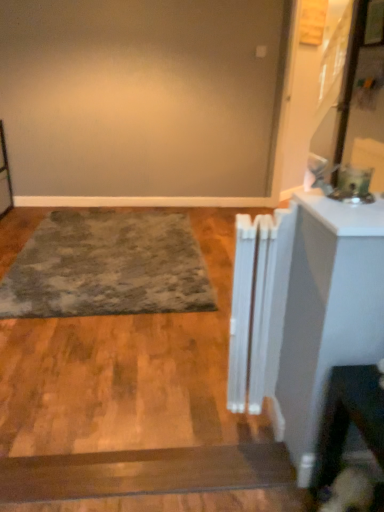
The height and width of the screenshot is (512, 384). What do you see at coordinates (107, 266) in the screenshot?
I see `textured gray rug at center` at bounding box center [107, 266].

Find the location of a particular element. The width and height of the screenshot is (384, 512). white plastic radiator at center is located at coordinates (258, 306).

What do you see at coordinates (349, 492) in the screenshot? I see `fuzzy brown dog at lower right` at bounding box center [349, 492].

The height and width of the screenshot is (512, 384). In order to click on white glossy counter top at right in this screenshot , I will do `click(344, 214)`.

Identify the location of textured gray rug at center. This screenshot has width=384, height=512. (107, 266).

Does textured gray rug at center have a greater height compared to white glossy counter top at right?

Correct, textured gray rug at center is much taller as white glossy counter top at right.

From the image's perspective, would you say textured gray rug at center is positioned over white glossy counter top at right?

Actually, textured gray rug at center appears below white glossy counter top at right in the image.

Is textured gray rug at center beside white glossy counter top at right?

textured gray rug at center and white glossy counter top at right are not in contact.

The image size is (384, 512). Find the location of `mat below the white glossy counter top at right (from the image's perspective)`. mat below the white glossy counter top at right (from the image's perspective) is located at coordinates (107, 266).

Between white plastic radiator at center and textured gray rug at center, which one has less height?

textured gray rug at center.

Is white plastic radiator at center turned away from textured gray rug at center?

No, textured gray rug at center is not at the back of white plastic radiator at center.

From the image's perspective, is white plastic radiator at center beneath textured gray rug at center?

Correct, white plastic radiator at center appears lower than textured gray rug at center in the image.

Which of these two, white plastic radiator at center or textured gray rug at center, is smaller?

With smaller size is white plastic radiator at center.

Can you see white glossy counter top at right touching textured gray rug at center?

No, white glossy counter top at right is not next to textured gray rug at center.

Which is farther from the camera, (x=302, y=206) or (x=92, y=308)?

Positioned behind is point (x=92, y=308).

Is white glossy counter top at right spatially inside textured gray rug at center, or outside of it?

white glossy counter top at right lies outside textured gray rug at center.

Is the position of fuzzy brown dog at lower right less distant than that of textured gray rug at center?

Yes, fuzzy brown dog at lower right is in front of textured gray rug at center.

Considering the positions of objects fuzzy brown dog at lower right and textured gray rug at center in the image provided, who is more to the right, fuzzy brown dog at lower right or textured gray rug at center?

Positioned to the right is fuzzy brown dog at lower right.

Consider the image. Is fuzzy brown dog at lower right beside textured gray rug at center?

They are not placed beside each other.

From the image's perspective, is fuzzy brown dog at lower right located above or below textured gray rug at center?

Based on their image positions, fuzzy brown dog at lower right is located beneath textured gray rug at center.

The width and height of the screenshot is (384, 512). In order to click on radiator that appears behind the white glossy counter top at right in this screenshot , I will do `click(258, 306)`.

From a real-world perspective, is white glossy counter top at right positioned under white plastic radiator at center based on gravity?

No, from a real-world perspective, white glossy counter top at right is not beneath white plastic radiator at center.

Does white glossy counter top at right have a smaller size compared to white plastic radiator at center?

Yes, white glossy counter top at right is smaller than white plastic radiator at center.

In terms of height, does white plastic radiator at center look taller or shorter compared to white glossy counter top at right?

Clearly, white plastic radiator at center is taller compared to white glossy counter top at right.

Which is farther from the camera, (241, 369) or (345, 211)?

Point (241, 369)

Considering the relative positions of white plastic radiator at center and white glossy counter top at right in the image provided, is white plastic radiator at center to the left of white glossy counter top at right from the viewer's perspective?

Yes.

Which object is wider, white plastic radiator at center or white glossy counter top at right?

white glossy counter top at right.

Is textured gray rug at center inside or outside of fuzzy brown dog at lower right?

The correct answer is: outside.

From the image's perspective, is textured gray rug at center beneath fuzzy brown dog at lower right?

Incorrect, from the image's perspective, textured gray rug at center is higher than fuzzy brown dog at lower right.

Who is smaller, textured gray rug at center or fuzzy brown dog at lower right?

With smaller size is fuzzy brown dog at lower right.

This screenshot has height=512, width=384. In order to click on counter top positioned vertically above the textured gray rug at center (from a real-world perspective) in this screenshot , I will do `click(344, 214)`.

Image resolution: width=384 pixels, height=512 pixels. What are the coordinates of `radiator that appears in front of the textured gray rug at center` in the screenshot? It's located at (258, 306).

Which object lies nearer to the anchor point white glossy counter top at right, textured gray rug at center or fuzzy brown dog at lower right?

fuzzy brown dog at lower right.

Estimate the real-world distances between objects in this image. Which object is closer to fuzzy brown dog at lower right, white plastic radiator at center or textured gray rug at center?

white plastic radiator at center is positioned closer to the anchor fuzzy brown dog at lower right.

Looking at this image, from the image, which object appears to be nearer to white glossy counter top at right, fuzzy brown dog at lower right or white plastic radiator at center?

white plastic radiator at center.

Looking at the image, which one is located further to textured gray rug at center, fuzzy brown dog at lower right or white plastic radiator at center?

fuzzy brown dog at lower right is positioned further to the anchor textured gray rug at center.

Looking at this image, considering their positions, is textured gray rug at center positioned further to white plastic radiator at center than fuzzy brown dog at lower right?

Among the two, textured gray rug at center is located further to white plastic radiator at center.

Looking at the image, which one is located further to white plastic radiator at center, fuzzy brown dog at lower right or textured gray rug at center?

textured gray rug at center is further to white plastic radiator at center.

Estimate the real-world distances between objects in this image. Which object is closer to textured gray rug at center, white glossy counter top at right or fuzzy brown dog at lower right?

white glossy counter top at right is positioned closer to the anchor textured gray rug at center.

Which object lies further to the anchor point textured gray rug at center, white plastic radiator at center or fuzzy brown dog at lower right?

Among the two, fuzzy brown dog at lower right is located further to textured gray rug at center.

What are the coordinates of `radiator between white glossy counter top at right and fuzzy brown dog at lower right from top to bottom` in the screenshot? It's located at (258, 306).

This screenshot has height=512, width=384. I want to click on dog positioned between white glossy counter top at right and textured gray rug at center from near to far, so click(x=349, y=492).

Locate an element on the screen. The image size is (384, 512). radiator between fuzzy brown dog at lower right and textured gray rug at center from front to back is located at coordinates (258, 306).

Find the location of a particular element. This screenshot has height=512, width=384. radiator located between white glossy counter top at right and textured gray rug at center in the depth direction is located at coordinates (258, 306).